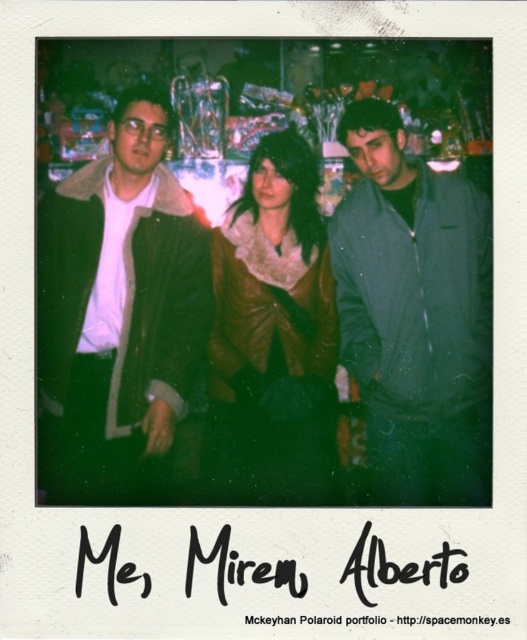
You are trying to decide which jacket to try on between the matte green jacket at center and the brown leather jacket at center. Based on their sizes in the image, which one do you think would have a larger physical size?

The matte green jacket at center might be wider than brown leather jacket at center, so it could have a larger physical size.